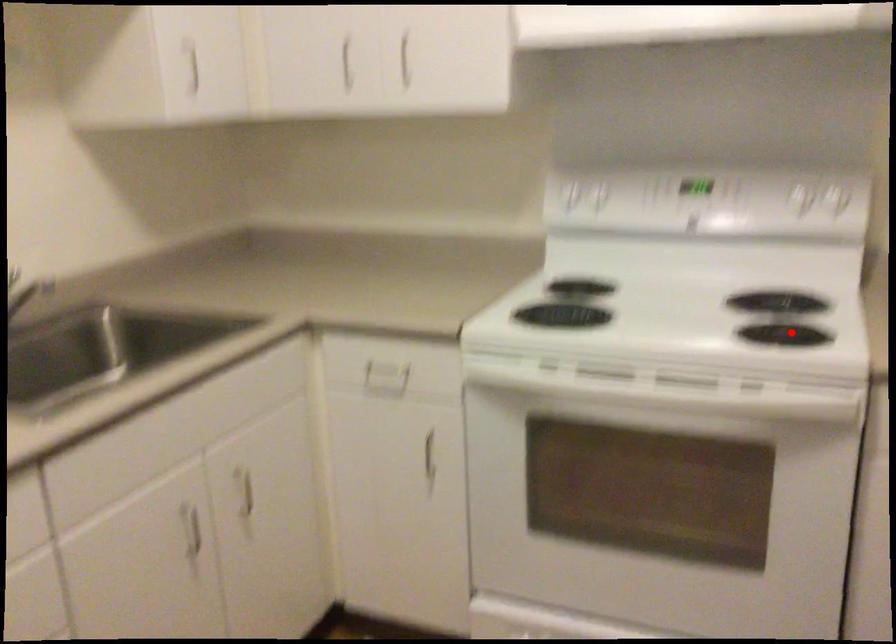
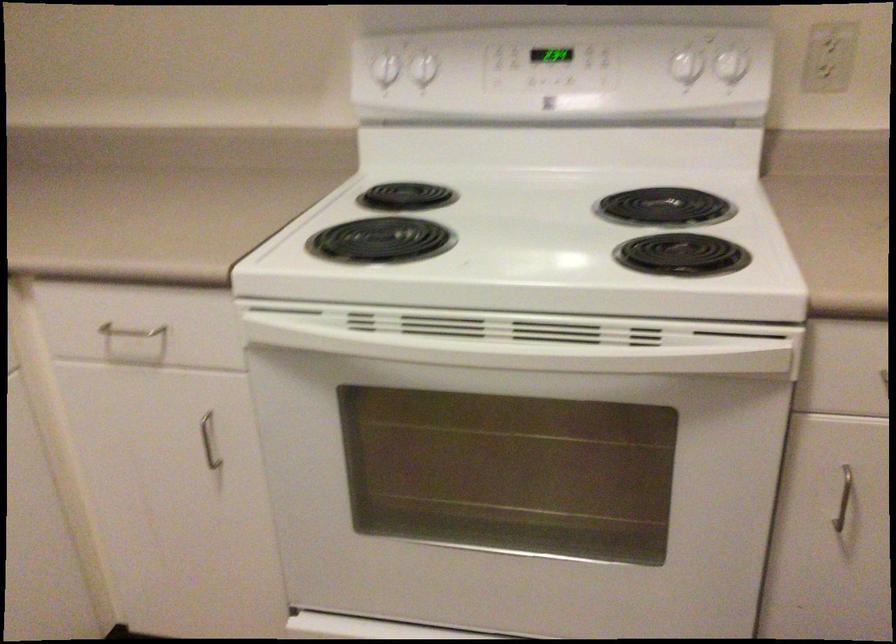
Question: I am providing you with two images of the same scene from different viewpoints. A red point is shown in image1. For the corresponding object point in image2, is it positioned nearer or farther from the camera?

Choices:
 (A) Nearer
 (B) Farther

Answer: (A)